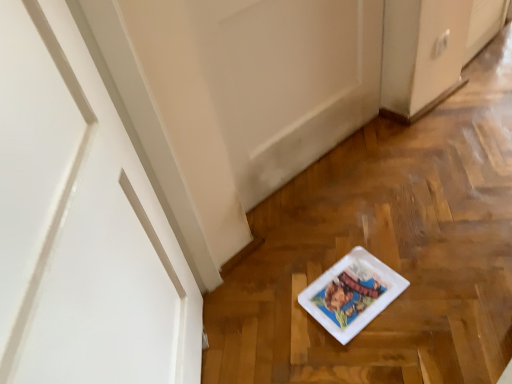
In order to click on vacant space underneath white glossy platter at center (from a real-world perspective) in this screenshot , I will do `click(349, 286)`.